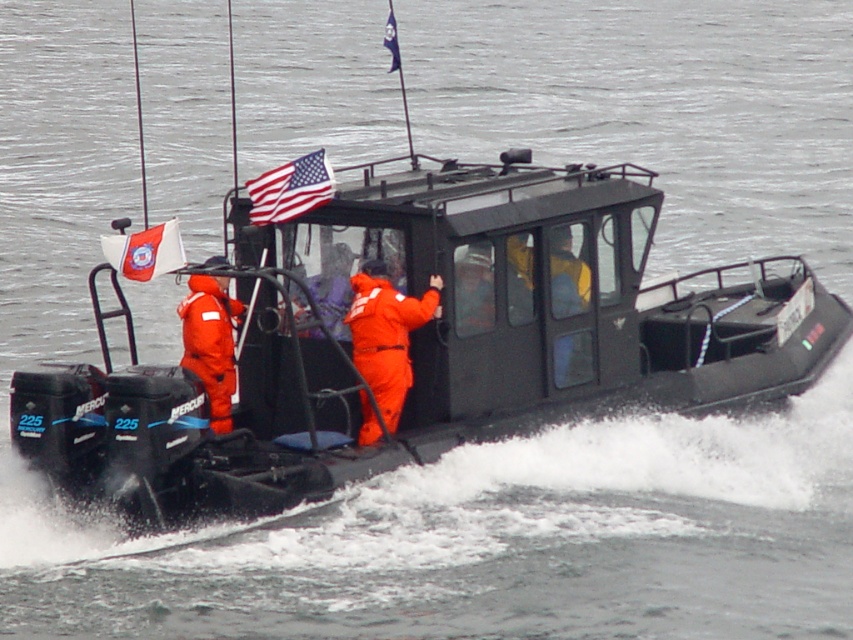
You are a safety inspector on the deck of the black motorboat. You need to reach the american flag at upper center from the orange smooth suit at center to check its condition. Can you safely do this without moving more than 4 feet?

The orange smooth suit at center is 3.95 feet away from the american flag at upper center, so yes, you can safely reach the american flag at upper center without moving more than 4 feet since the distance is just under 4 feet.